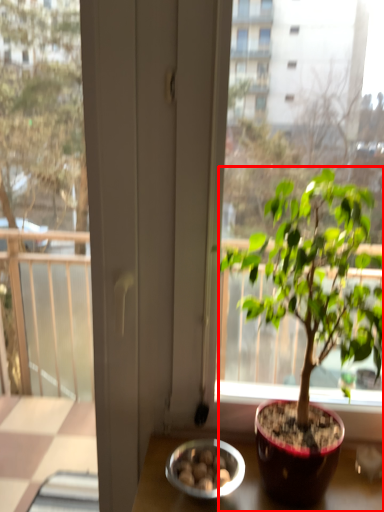
Question: Where is houseplant (annotated by the red box) located in relation to bowl in the image?

Choices:
 (A) right
 (B) left

Answer: (A)